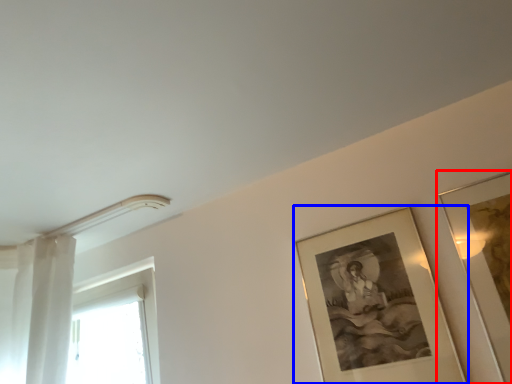
Question: Which point is closer to the camera, picture frame (highlighted by a red box) or picture frame (highlighted by a blue box)?

Choices:
 (A) picture frame
 (B) picture frame

Answer: (A)